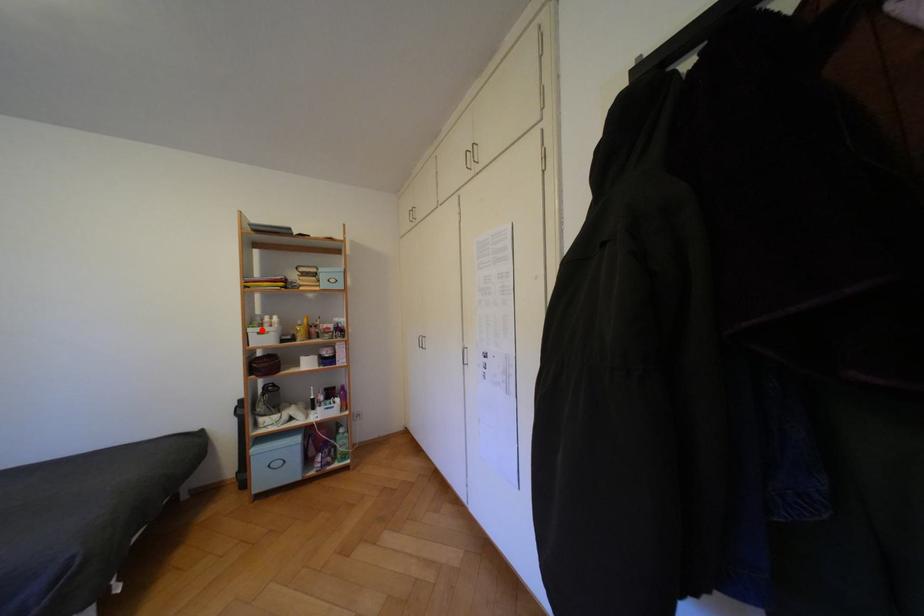
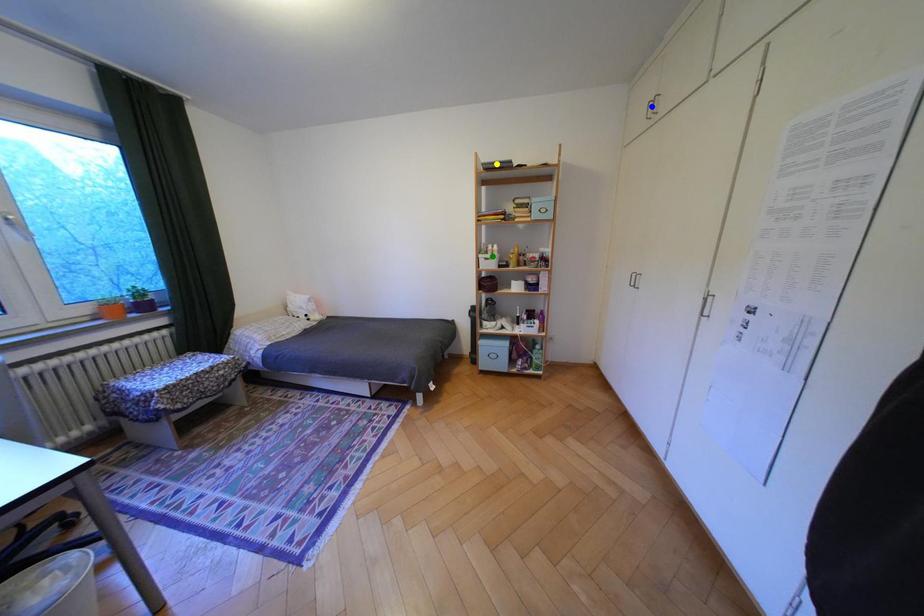
Question: I am providing you with two images of the same scene from different viewpoints. A red point is marked on the first image. You are given multiple points on the second image. Can you choose the point in image 2 that corresponds to the point in image 1?

Choices:
 (A) blue point
 (B) green point
 (C) yellow point

Answer: (B)